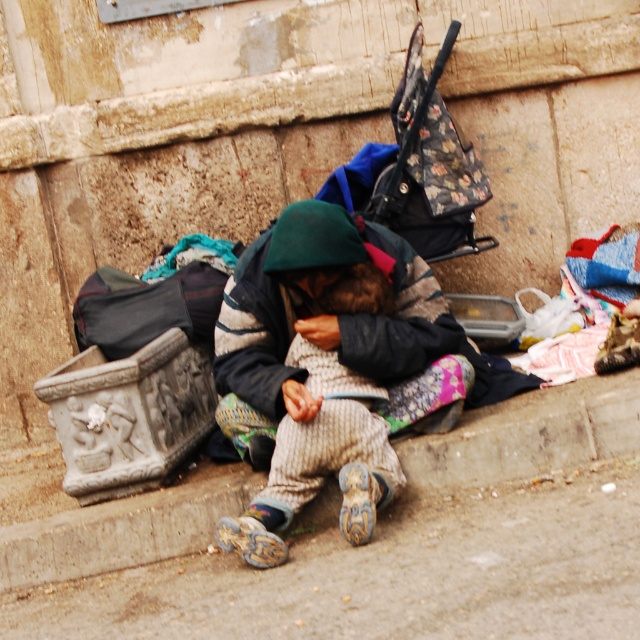
You are standing at the point with coordinates point [244,593] and want to walk to the point with coordinates point [259,436]. Which direction should you move?

You should move backward because point [244,593] is in front of point [259,436].

You are standing at the origin point in the image. You want to move to the brown concrete pavement at lower center. What are the coordinates you need to move to?

The coordinates for the brown concrete pavement at lower center are at point (388,573).